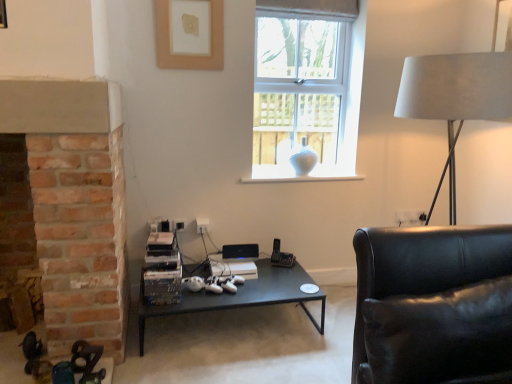
Question: Should I look upward or downward to see white fabric lampshade at right?

Choices:
 (A) down
 (B) up

Answer: (B)

Question: Could you tell me if white glossy vase at center is turned towards black leather couch at right?

Choices:
 (A) no
 (B) yes

Answer: (B)

Question: Does white glossy vase at center have a lesser height compared to black leather couch at right?

Choices:
 (A) yes
 (B) no

Answer: (A)

Question: Is white glossy vase at center smaller than black leather couch at right?

Choices:
 (A) no
 (B) yes

Answer: (B)

Question: From a real-world perspective, is white glossy vase at center over black leather couch at right?

Choices:
 (A) yes
 (B) no

Answer: (A)

Question: From a real-world perspective, is white glossy vase at center beneath black leather couch at right?

Choices:
 (A) yes
 (B) no

Answer: (B)

Question: Is white glossy vase at center at the right side of black leather couch at right?

Choices:
 (A) no
 (B) yes

Answer: (A)

Question: Is white fabric lampshade at right taller than black leather couch at right?

Choices:
 (A) yes
 (B) no

Answer: (A)

Question: Is white fabric lampshade at right not inside black leather couch at right?

Choices:
 (A) yes
 (B) no

Answer: (A)

Question: Does white fabric lampshade at right appear on the right side of black leather couch at right?

Choices:
 (A) no
 (B) yes

Answer: (B)

Question: Does white fabric lampshade at right contain black leather couch at right?

Choices:
 (A) yes
 (B) no

Answer: (B)

Question: Considering the relative sizes of white fabric lampshade at right and black leather couch at right in the image provided, is white fabric lampshade at right wider than black leather couch at right?

Choices:
 (A) no
 (B) yes

Answer: (A)

Question: From a real-world perspective, is white fabric lampshade at right on top of black leather couch at right?

Choices:
 (A) no
 (B) yes

Answer: (B)

Question: Is white fabric lampshade at right aimed at white glass vase at upper center?

Choices:
 (A) yes
 (B) no

Answer: (B)